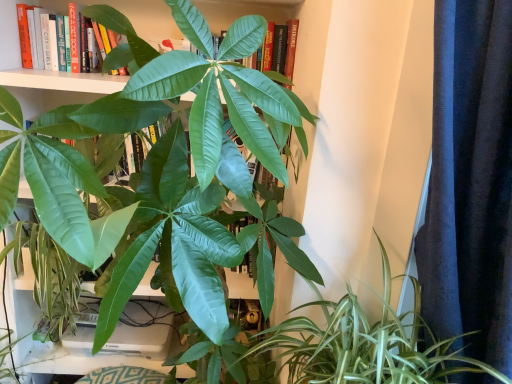
I want to click on green glossy leafy plant at lower right, so click(367, 344).

The height and width of the screenshot is (384, 512). What do you see at coordinates (470, 182) in the screenshot?
I see `dark blue textured curtain at right` at bounding box center [470, 182].

The width and height of the screenshot is (512, 384). What do you see at coordinates (122, 31) in the screenshot?
I see `green matte leaf at upper center` at bounding box center [122, 31].

In order to click on green matte leaf at upper center in this screenshot , I will do `click(122, 31)`.

Locate an element on the screen. green glossy leafy plant at lower right is located at coordinates (367, 344).

Could you tell me if dark blue textured curtain at right is turned towards green glossy leafy plant at lower right?

No, dark blue textured curtain at right does not turn towards green glossy leafy plant at lower right.

Which object is further away from the camera taking this photo, dark blue textured curtain at right or green glossy leafy plant at lower right?

green glossy leafy plant at lower right.

Between dark blue textured curtain at right and green glossy leafy plant at lower right, which one appears on the right side from the viewer's perspective?

dark blue textured curtain at right is more to the right.

From a real-world perspective, between green glossy leafy plant at lower right and dark blue textured curtain at right, who is vertically lower?

In real-world perspective, green glossy leafy plant at lower right is lower.

Looking at this image, considering the sizes of objects green glossy leafy plant at lower right and dark blue textured curtain at right in the image provided, who is shorter, green glossy leafy plant at lower right or dark blue textured curtain at right?

With less height is green glossy leafy plant at lower right.

Is green glossy leafy plant at lower right facing towards dark blue textured curtain at right?

Yes, green glossy leafy plant at lower right is facing dark blue textured curtain at right.

How much distance is there between green glossy leafy plant at lower right and dark blue textured curtain at right?

green glossy leafy plant at lower right is 8.15 inches from dark blue textured curtain at right.

From a real-world perspective, does green glossy leafy plant at lower right sit lower than green matte leaf at upper center?

Yes, from a real-world perspective, green glossy leafy plant at lower right is beneath green matte leaf at upper center.

From the image's perspective, is green glossy leafy plant at lower right on green matte leaf at upper center?

Actually, green glossy leafy plant at lower right appears below green matte leaf at upper center in the image.

In the scene shown: Are green glossy leafy plant at lower right and green matte leaf at upper center far apart?

green glossy leafy plant at lower right is actually quite close to green matte leaf at upper center.

Can you tell me how much green glossy leafy plant at lower right and green matte leaf at upper center differ in facing direction?

green glossy leafy plant at lower right and green matte leaf at upper center are facing 87 degrees away from each other.

Considering the positions of objects green matte leaf at upper center and green glossy leafy plant at lower right in the image provided, who is behind, green matte leaf at upper center or green glossy leafy plant at lower right?

green matte leaf at upper center is further away from the camera.

Does green matte leaf at upper center appear on the left side of green glossy leafy plant at lower right?

Yes, green matte leaf at upper center is to the left of green glossy leafy plant at lower right.

Is green matte leaf at upper center completely or partially outside of green glossy leafy plant at lower right?

Indeed, green matte leaf at upper center is completely outside green glossy leafy plant at lower right.

Looking at this image, is green matte leaf at upper center touching dark blue textured curtain at right?

green matte leaf at upper center is not next to dark blue textured curtain at right, and they're not touching.

Is green matte leaf at upper center spatially inside dark blue textured curtain at right, or outside of it?

green matte leaf at upper center is outside dark blue textured curtain at right.

At what (x,y) coordinates should I click in order to perform the action: click on leaf that appears above the dark blue textured curtain at right (from the image's perspective). Please return your answer as a coordinate pair (x, y). This screenshot has width=512, height=384. Looking at the image, I should click on (122, 31).

Based on their sizes in the image, would you say dark blue textured curtain at right is bigger or smaller than green matte leaf at upper center?

Considering their sizes, dark blue textured curtain at right takes up more space than green matte leaf at upper center.

Which point is more forward, (501,154) or (144,50)?

The point (144,50) is closer to the camera.

Would you say dark blue textured curtain at right is to the left or to the right of green matte leaf at upper center in the picture?

dark blue textured curtain at right is positioned on green matte leaf at upper center's right side.

You are a GUI agent. You are given a task and a screenshot of the screen. Output one action in this format:
    pyautogui.click(x=<x>, y=<y>)
    Task: Click on the houseplant below the dark blue textured curtain at right (from the image's perspective)
    
    Given the screenshot: What is the action you would take?
    pyautogui.click(x=367, y=344)

Find the location of `houseplant on the left of dark blue textured curtain at right`. houseplant on the left of dark blue textured curtain at right is located at coordinates (367, 344).

Which object lies further to the anchor point green matte leaf at upper center, dark blue textured curtain at right or green glossy leafy plant at lower right?

Among the two, green glossy leafy plant at lower right is located further to green matte leaf at upper center.

Considering their positions, is green glossy leafy plant at lower right positioned further to green matte leaf at upper center than dark blue textured curtain at right?

Among the two, green glossy leafy plant at lower right is located further to green matte leaf at upper center.

Based on their spatial positions, is green matte leaf at upper center or green glossy leafy plant at lower right further from dark blue textured curtain at right?

green matte leaf at upper center lies further to dark blue textured curtain at right than the other object.

Which object lies nearer to the anchor point dark blue textured curtain at right, green glossy leafy plant at lower right or green matte leaf at upper center?

green glossy leafy plant at lower right is closer to dark blue textured curtain at right.

From the image, which object appears to be nearer to green glossy leafy plant at lower right, green matte leaf at upper center or dark blue textured curtain at right?

Among the two, dark blue textured curtain at right is located nearer to green glossy leafy plant at lower right.

When comparing their distances from green glossy leafy plant at lower right, does dark blue textured curtain at right or green matte leaf at upper center seem further?

green matte leaf at upper center is positioned further to the anchor green glossy leafy plant at lower right.

Identify the location of houseplant between dark blue textured curtain at right and green matte leaf at upper center along the z-axis. (367, 344).